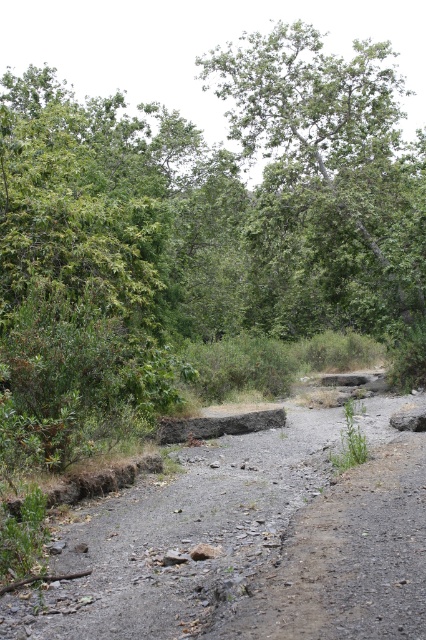
Question: Which point appears farthest from the camera in this image?

Choices:
 (A) (416, 458)
 (B) (265, 323)

Answer: (B)

Question: Does dull gray gravel at center appear on the right side of green leafy tree at center?

Choices:
 (A) yes
 (B) no

Answer: (B)

Question: Which point is farther to the camera?

Choices:
 (A) (284, 275)
 (B) (218, 509)

Answer: (A)

Question: Considering the relative positions of dull gray gravel at center and green leafy tree at center in the image provided, where is dull gray gravel at center located with respect to green leafy tree at center?

Choices:
 (A) right
 (B) left

Answer: (B)

Question: Is dull gray gravel at center behind green leafy tree at center?

Choices:
 (A) no
 (B) yes

Answer: (A)